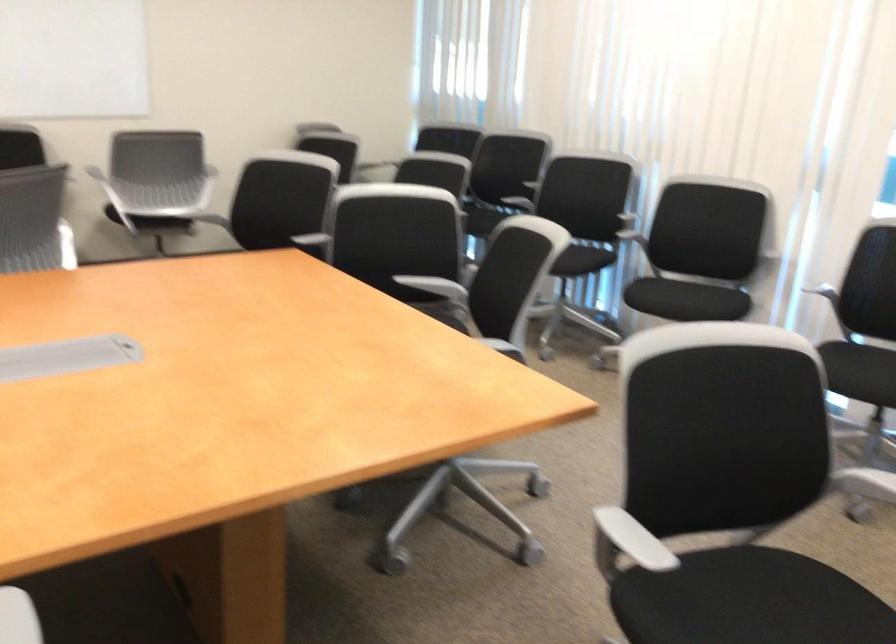
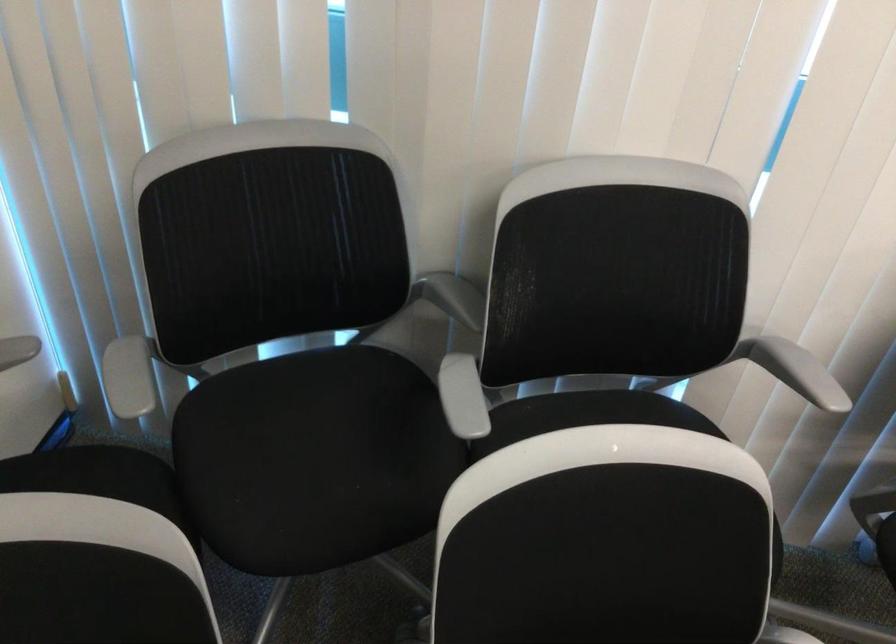
In the second image, find the point that corresponds to pixel 512 202 in the first image.

(605, 412)